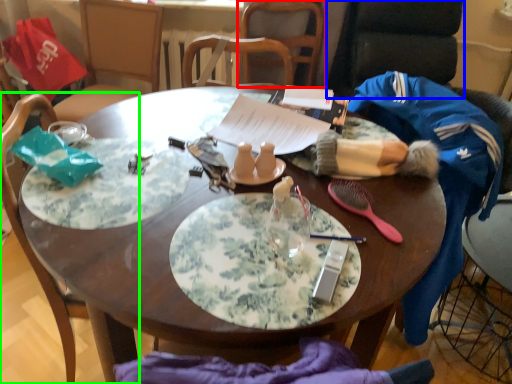
Question: Which object is positioned farthest from chair (highlighted by a red box)? Select from armchair (highlighted by a blue box) and chair (highlighted by a green box).

Choices:
 (A) armchair
 (B) chair

Answer: (B)